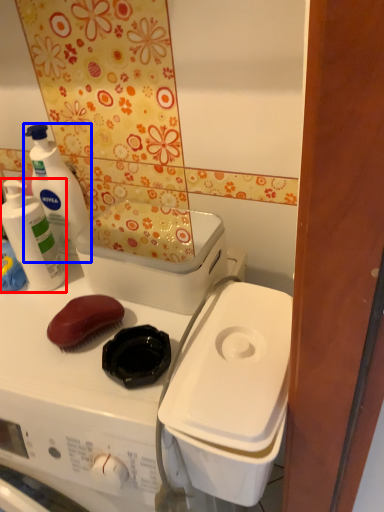
Question: Which object is closer to the camera taking this photo, cleaning product (highlighted by a red box) or cleaning product (highlighted by a blue box)?

Choices:
 (A) cleaning product
 (B) cleaning product

Answer: (A)